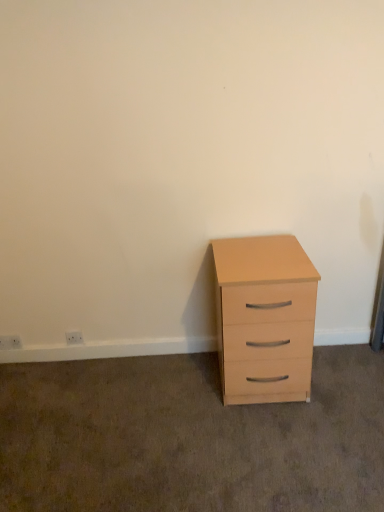
What is the approximate height of white plastic electric outlet at lower left, positioned as the second electric outlet in right-to-left order?

The height of white plastic electric outlet at lower left, positioned as the second electric outlet in right-to-left order, is 8.79 centimeters.

Image resolution: width=384 pixels, height=512 pixels. Describe the element at coordinates (74, 338) in the screenshot. I see `white plastic electric outlet at lower left, which is the 2th electric outlet from left to right` at that location.

What is the approximate height of white plastic electric outlet at lower left, the 1th electric outlet viewed from the right?

3.45 inches.

Find the location of a particular element. Image resolution: width=384 pixels, height=512 pixels. white plastic electric outlet at lower left, marked as the 1th electric outlet in a left-to-right arrangement is located at coordinates (10, 342).

In the scene shown: Between light wood chest of drawers at right and white plastic electric outlet at lower left, positioned as the second electric outlet in right-to-left order, which one is positioned in front?

light wood chest of drawers at right.

Is light wood chest of drawers at right positioned beyond the bounds of white plastic electric outlet at lower left, positioned as the second electric outlet in right-to-left order?

light wood chest of drawers at right lies outside white plastic electric outlet at lower left, positioned as the second electric outlet in right-to-left order,'s area.

Consider the image. Who is shorter, light wood chest of drawers at right or white plastic electric outlet at lower left, marked as the 1th electric outlet in a left-to-right arrangement?

white plastic electric outlet at lower left, marked as the 1th electric outlet in a left-to-right arrangement.

Considering the sizes of objects light wood chest of drawers at right and white plastic electric outlet at lower left, marked as the 1th electric outlet in a left-to-right arrangement, in the image provided, who is wider, light wood chest of drawers at right or white plastic electric outlet at lower left, marked as the 1th electric outlet in a left-to-right arrangement,?

Wider between the two is light wood chest of drawers at right.

Is white plastic electric outlet at lower left, marked as the 1th electric outlet in a left-to-right arrangement, turned away from light wood chest of drawers at right?

No, light wood chest of drawers at right is not at the back of white plastic electric outlet at lower left, marked as the 1th electric outlet in a left-to-right arrangement.

Does point (9, 338) come farther from viewer compared to point (244, 278)?

Yes, it is.

Is white plastic electric outlet at lower left, marked as the 1th electric outlet in a left-to-right arrangement, in contact with light wood chest of drawers at right?

white plastic electric outlet at lower left, marked as the 1th electric outlet in a left-to-right arrangement, and light wood chest of drawers at right are not in contact.

From the image's perspective, is white plastic electric outlet at lower left, positioned as the second electric outlet in right-to-left order, located above or below light wood chest of drawers at right?

white plastic electric outlet at lower left, positioned as the second electric outlet in right-to-left order, is below light wood chest of drawers at right.

Which is more to the right, white plastic electric outlet at lower left, positioned as the second electric outlet in right-to-left order, or white plastic electric outlet at lower left, which is the 2th electric outlet from left to right?

white plastic electric outlet at lower left, which is the 2th electric outlet from left to right.

Can you confirm if white plastic electric outlet at lower left, marked as the 1th electric outlet in a left-to-right arrangement, is thinner than white plastic electric outlet at lower left, which is the 2th electric outlet from left to right?

Yes, white plastic electric outlet at lower left, marked as the 1th electric outlet in a left-to-right arrangement, is thinner than white plastic electric outlet at lower left, which is the 2th electric outlet from left to right.

Do you think white plastic electric outlet at lower left, marked as the 1th electric outlet in a left-to-right arrangement, is within white plastic electric outlet at lower left, the 1th electric outlet viewed from the right, or outside of it?

white plastic electric outlet at lower left, marked as the 1th electric outlet in a left-to-right arrangement, is located beyond the bounds of white plastic electric outlet at lower left, the 1th electric outlet viewed from the right.

Would you say light wood chest of drawers at right is outside white plastic electric outlet at lower left, the 1th electric outlet viewed from the right?

Yes, light wood chest of drawers at right is located beyond the bounds of white plastic electric outlet at lower left, the 1th electric outlet viewed from the right.

In the scene shown: From a real-world perspective, which object stands above the other?

light wood chest of drawers at right, from a real-world perspective.

Does light wood chest of drawers at right appear on the right side of white plastic electric outlet at lower left, the 1th electric outlet viewed from the right?

Indeed, light wood chest of drawers at right is positioned on the right side of white plastic electric outlet at lower left, the 1th electric outlet viewed from the right.

Is light wood chest of drawers at right smaller than white plastic electric outlet at lower left, the 1th electric outlet viewed from the right?

Incorrect, light wood chest of drawers at right is not smaller in size than white plastic electric outlet at lower left, the 1th electric outlet viewed from the right.

From a real-world perspective, is white plastic electric outlet at lower left, the 1th electric outlet viewed from the right, under light wood chest of drawers at right?

Correct, in the physical world, white plastic electric outlet at lower left, the 1th electric outlet viewed from the right, is lower than light wood chest of drawers at right.

Can you confirm if white plastic electric outlet at lower left, which is the 2th electric outlet from left to right, is positioned to the right of light wood chest of drawers at right?

No, white plastic electric outlet at lower left, which is the 2th electric outlet from left to right, is not to the right of light wood chest of drawers at right.

Is the position of white plastic electric outlet at lower left, which is the 2th electric outlet from left to right, less distant than that of light wood chest of drawers at right?

No, white plastic electric outlet at lower left, which is the 2th electric outlet from left to right, is further to the viewer.

From the image's perspective, is white plastic electric outlet at lower left, the 1th electric outlet viewed from the right, located above light wood chest of drawers at right?

No.

Between white plastic electric outlet at lower left, which is the 2th electric outlet from left to right, and white plastic electric outlet at lower left, marked as the 1th electric outlet in a left-to-right arrangement, which one has larger width?

white plastic electric outlet at lower left, which is the 2th electric outlet from left to right.

Is white plastic electric outlet at lower left, which is the 2th electric outlet from left to right, bigger than white plastic electric outlet at lower left, positioned as the second electric outlet in right-to-left order?

No.

How many degrees apart are the facing directions of white plastic electric outlet at lower left, which is the 2th electric outlet from left to right, and white plastic electric outlet at lower left, positioned as the second electric outlet in right-to-left order?

The facing directions of white plastic electric outlet at lower left, which is the 2th electric outlet from left to right, and white plastic electric outlet at lower left, positioned as the second electric outlet in right-to-left order, are 1.22 degrees apart.

Is white plastic electric outlet at lower left, the 1th electric outlet viewed from the right, not within white plastic electric outlet at lower left, marked as the 1th electric outlet in a left-to-right arrangement?

Indeed, white plastic electric outlet at lower left, the 1th electric outlet viewed from the right, is completely outside white plastic electric outlet at lower left, marked as the 1th electric outlet in a left-to-right arrangement.

There is a white plastic electric outlet at lower left, marked as the 1th electric outlet in a left-to-right arrangement. Where is `the chest of drawers above it (from a real-world perspective)`? the chest of drawers above it (from a real-world perspective) is located at coordinates (264, 318).

Starting from the light wood chest of drawers at right, which electric outlet is the 2nd one behind? Please provide its 2D coordinates.

[(10, 342)]

Considering their positions, is white plastic electric outlet at lower left, marked as the 1th electric outlet in a left-to-right arrangement, positioned further to white plastic electric outlet at lower left, which is the 2th electric outlet from left to right, than light wood chest of drawers at right?

light wood chest of drawers at right lies further to white plastic electric outlet at lower left, which is the 2th electric outlet from left to right, than the other object.

From the image, which object appears to be farther from white plastic electric outlet at lower left, positioned as the second electric outlet in right-to-left order, white plastic electric outlet at lower left, the 1th electric outlet viewed from the right, or light wood chest of drawers at right?

light wood chest of drawers at right is positioned further to the anchor white plastic electric outlet at lower left, positioned as the second electric outlet in right-to-left order.

Estimate the real-world distances between objects in this image. Which object is closer to light wood chest of drawers at right, white plastic electric outlet at lower left, which is the 2th electric outlet from left to right, or white plastic electric outlet at lower left, positioned as the second electric outlet in right-to-left order?

The object closer to light wood chest of drawers at right is white plastic electric outlet at lower left, which is the 2th electric outlet from left to right.

Estimate the real-world distances between objects in this image. Which object is further from light wood chest of drawers at right, white plastic electric outlet at lower left, marked as the 1th electric outlet in a left-to-right arrangement, or white plastic electric outlet at lower left, the 1th electric outlet viewed from the right?

→ The object further to light wood chest of drawers at right is white plastic electric outlet at lower left, marked as the 1th electric outlet in a left-to-right arrangement.

Based on the photo, from the image, which object appears to be farther from white plastic electric outlet at lower left, the 1th electric outlet viewed from the right, light wood chest of drawers at right or white plastic electric outlet at lower left, positioned as the second electric outlet in right-to-left order?

light wood chest of drawers at right.

Looking at the image, which one is located further to white plastic electric outlet at lower left, marked as the 1th electric outlet in a left-to-right arrangement, light wood chest of drawers at right or white plastic electric outlet at lower left, which is the 2th electric outlet from left to right?

light wood chest of drawers at right is further to white plastic electric outlet at lower left, marked as the 1th electric outlet in a left-to-right arrangement.

Where is `electric outlet located between white plastic electric outlet at lower left, positioned as the second electric outlet in right-to-left order, and light wood chest of drawers at right in the left-right direction`? This screenshot has width=384, height=512. electric outlet located between white plastic electric outlet at lower left, positioned as the second electric outlet in right-to-left order, and light wood chest of drawers at right in the left-right direction is located at coordinates (74, 338).